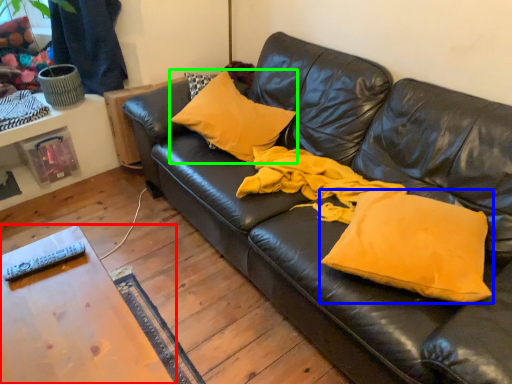
Question: Considering the real-world distances, which object is farthest from table (highlighted by a red box)? pillow (highlighted by a blue box) or pillow (highlighted by a green box)?

Choices:
 (A) pillow
 (B) pillow

Answer: (B)